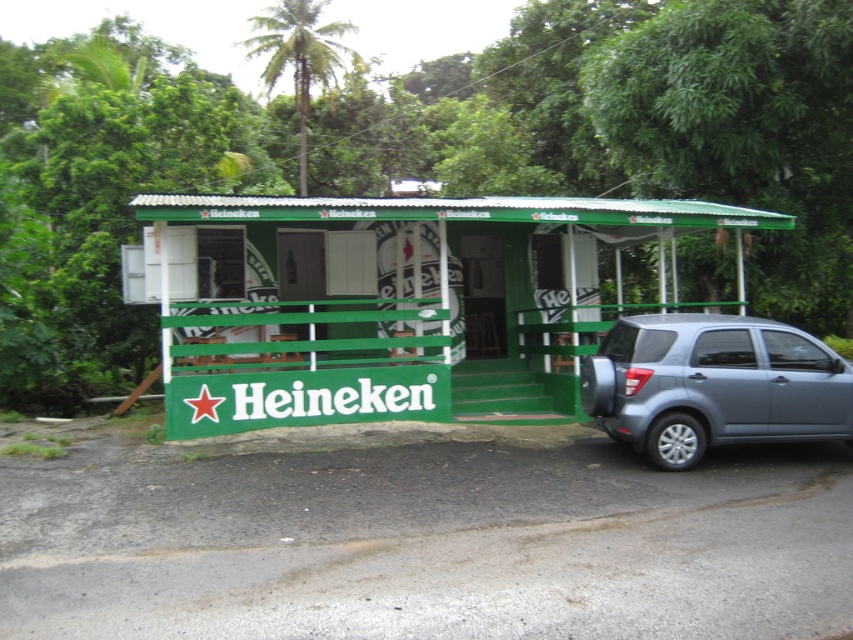
Question: Does green painted wood hut at center appear over gray metallic suv at right?

Choices:
 (A) no
 (B) yes

Answer: (B)

Question: Can you confirm if green painted wood hut at center is positioned above gray metallic suv at right?

Choices:
 (A) no
 (B) yes

Answer: (B)

Question: Which point is farther to the camera?

Choices:
 (A) (531, 273)
 (B) (721, 356)

Answer: (A)

Question: Which point is farther to the camera?

Choices:
 (A) gray metallic suv at right
 (B) green painted wood hut at center

Answer: (B)

Question: Does green painted wood hut at center appear under gray metallic suv at right?

Choices:
 (A) no
 (B) yes

Answer: (A)